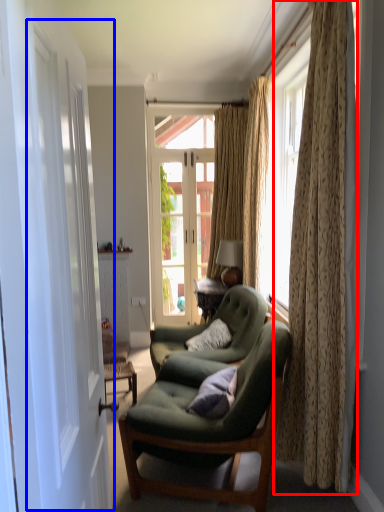
Question: Which of the following is the farthest to the observer, curtain (highlighted by a red box) or screen door (highlighted by a blue box)?

Choices:
 (A) curtain
 (B) screen door

Answer: (A)